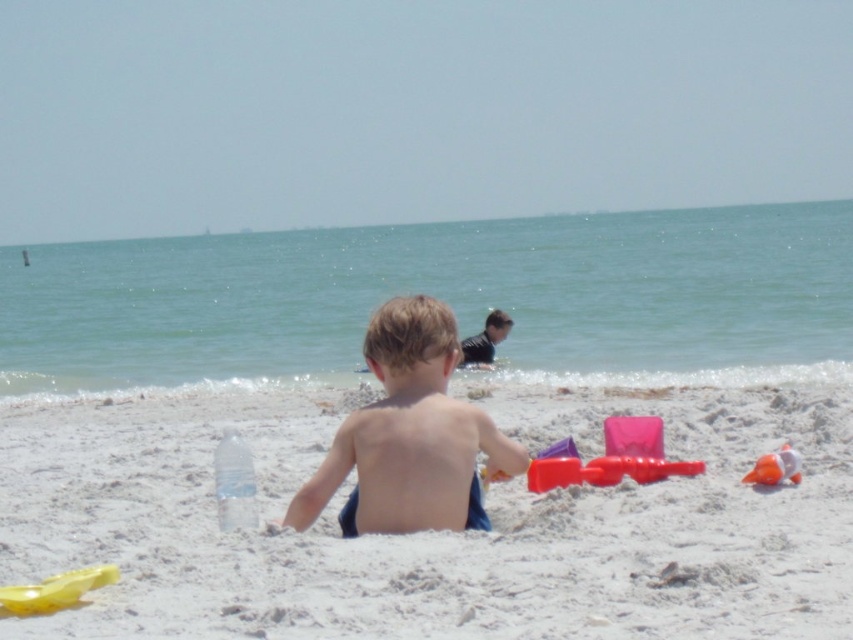
This screenshot has height=640, width=853. Describe the element at coordinates (55, 589) in the screenshot. I see `rubber yellow shovel at lower left` at that location.

Identify the location of rubber yellow shovel at lower left. This screenshot has height=640, width=853. (55, 589).

Who is more distant from viewer, (48, 608) or (503, 314)?

The point (503, 314) is behind.

Does rubber yellow shovel at lower left appear under dark blue wetsuit at upper center?

Correct, rubber yellow shovel at lower left is located below dark blue wetsuit at upper center.

Describe the element at coordinates (55, 589) in the screenshot. I see `rubber yellow shovel at lower left` at that location.

Where is `rubber yellow shovel at lower left`? The image size is (853, 640). rubber yellow shovel at lower left is located at coordinates (55, 589).

Based on the photo, does smooth sand at center have a larger size compared to rubber yellow shovel at lower left?

Indeed, smooth sand at center has a larger size compared to rubber yellow shovel at lower left.

Can you confirm if smooth sand at center is positioned to the right of rubber yellow shovel at lower left?

Correct, you'll find smooth sand at center to the right of rubber yellow shovel at lower left.

This screenshot has width=853, height=640. Find the location of `smooth sand at center`. smooth sand at center is located at coordinates (434, 532).